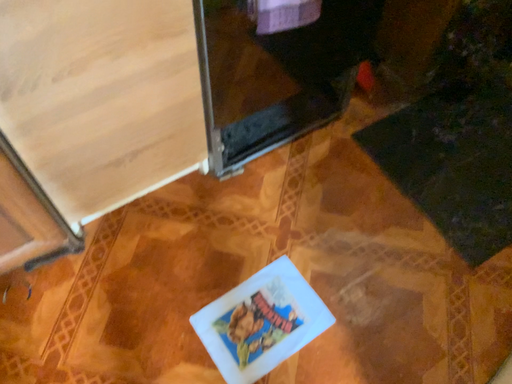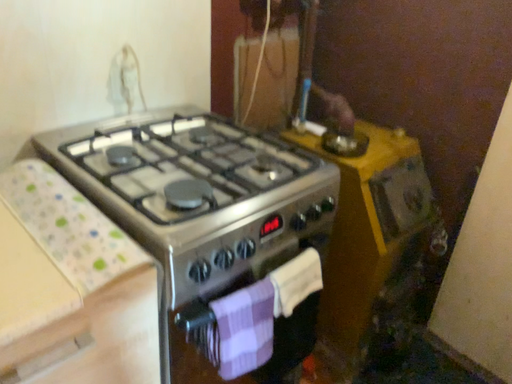
Question: Which way did the camera rotate in the video?

Choices:
 (A) rotated downward
 (B) rotated upward

Answer: (B)